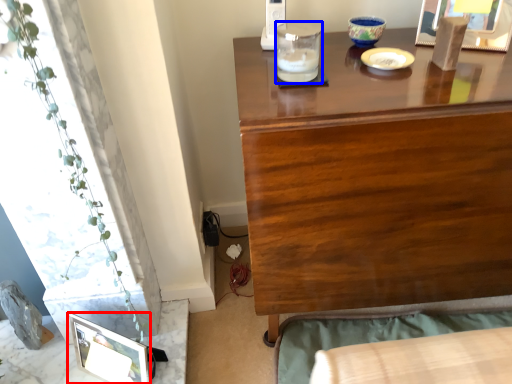
Question: Which object appears farthest to the camera in this image, picture frame (highlighted by a red box) or candle holder (highlighted by a blue box)?

Choices:
 (A) picture frame
 (B) candle holder

Answer: (A)